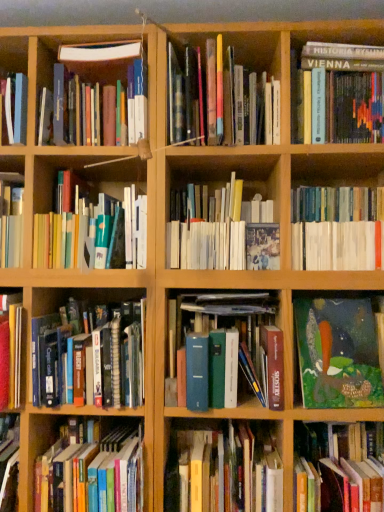
Question: Is hardcover books at center, acting as the 7th book starting from the bottom, shorter than matte hardcover books at center left, marked as the ninth book in a bottom-to-top arrangement?

Choices:
 (A) no
 (B) yes

Answer: (A)

Question: From a real-world perspective, is hardcover books at center, which ranks as the 6th book in top-to-bottom order, located higher than matte hardcover books at center left, the 4th book from the top?

Choices:
 (A) no
 (B) yes

Answer: (A)

Question: Is the depth of hardcover books at center, which ranks as the 6th book in top-to-bottom order, less than that of matte hardcover books at center left, the 4th book from the top?

Choices:
 (A) no
 (B) yes

Answer: (B)

Question: Considering the relative positions of hardcover books at center, which ranks as the 6th book in top-to-bottom order, and matte hardcover books at center left, the 4th book from the top, in the image provided, is hardcover books at center, which ranks as the 6th book in top-to-bottom order, to the right of matte hardcover books at center left, the 4th book from the top, from the viewer's perspective?

Choices:
 (A) no
 (B) yes

Answer: (B)

Question: Is hardcover books at center, which ranks as the 6th book in top-to-bottom order, completely or partially outside of matte hardcover books at center left, marked as the ninth book in a bottom-to-top arrangement?

Choices:
 (A) no
 (B) yes

Answer: (B)

Question: Can you confirm if hardcover books at center, which ranks as the 6th book in top-to-bottom order, is wider than matte hardcover books at center left, marked as the ninth book in a bottom-to-top arrangement?

Choices:
 (A) yes
 (B) no

Answer: (A)

Question: Is hardcover books at center, which ranks as the 6th book in top-to-bottom order, further to camera compared to hardcover book at center, which ranks as the 1th book in bottom-to-top order?

Choices:
 (A) yes
 (B) no

Answer: (A)

Question: Is hardcover books at center, which ranks as the 6th book in top-to-bottom order, facing away from hardcover book at center, which ranks as the 1th book in bottom-to-top order?

Choices:
 (A) yes
 (B) no

Answer: (B)

Question: Can you confirm if hardcover books at center, acting as the 7th book starting from the bottom, is taller than hardcover book at center, placed as the 12th book when sorted from top to bottom?

Choices:
 (A) yes
 (B) no

Answer: (A)

Question: Can you confirm if hardcover books at center, which ranks as the 6th book in top-to-bottom order, is positioned to the left of hardcover book at center, placed as the 12th book when sorted from top to bottom?

Choices:
 (A) no
 (B) yes

Answer: (B)

Question: From a real-world perspective, is hardcover books at center, which ranks as the 6th book in top-to-bottom order, located beneath hardcover book at center, which ranks as the 1th book in bottom-to-top order?

Choices:
 (A) no
 (B) yes

Answer: (A)

Question: Is hardcover books at center, acting as the 7th book starting from the bottom, closer to camera compared to hardcover book at center, placed as the 12th book when sorted from top to bottom?

Choices:
 (A) yes
 (B) no

Answer: (B)

Question: Is green textured painting at lower right, the eighth book in the top-to-bottom sequence, facing away from matte hardcover books at center left, the 4th book from the top?

Choices:
 (A) yes
 (B) no

Answer: (B)